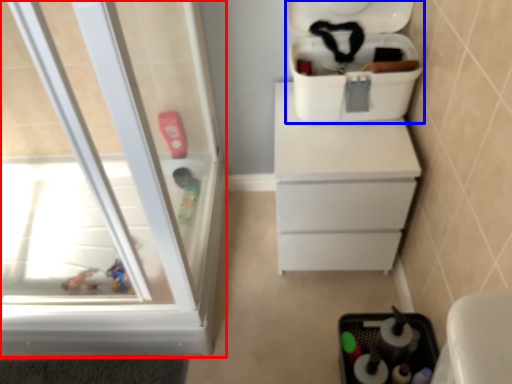
Question: Among these objects, which one is farthest to the camera, screen door (highlighted by a red box) or cooler (highlighted by a blue box)?

Choices:
 (A) screen door
 (B) cooler

Answer: (B)